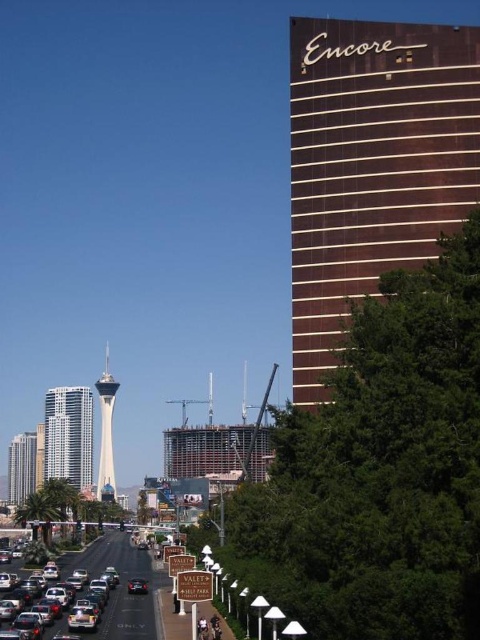
You are a city planner evaluating the skyline. You need to determine which structure occupies more space in the foreground. Based on the image, which is larger between the white glass tower at center and the shiny silver skyscraper at left?

The white glass tower at center is larger than the shiny silver skyscraper at left, so it occupies more space in the foreground.

You are a drone operator who needs to fly a drone from the Stratosphere Tower to the white glass building at center. According to the coordinates provided, in which direction should the drone move relative to the Stratosphere Tower?

The white glass building at center is located at coordinates point (69, 435). Since the Stratosphere Tower is on the left side of the image, the drone should move towards the right and slightly downward to reach the white glass building at center.